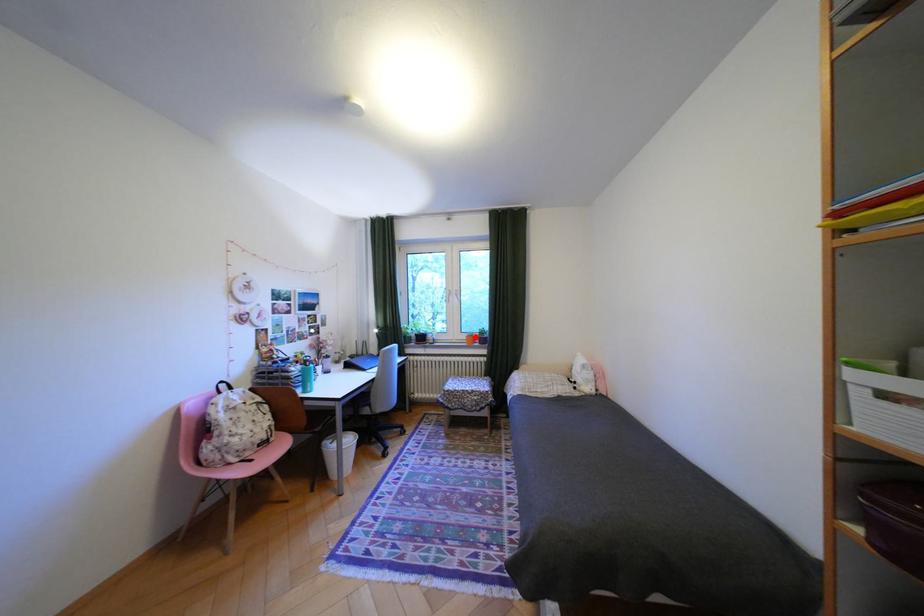
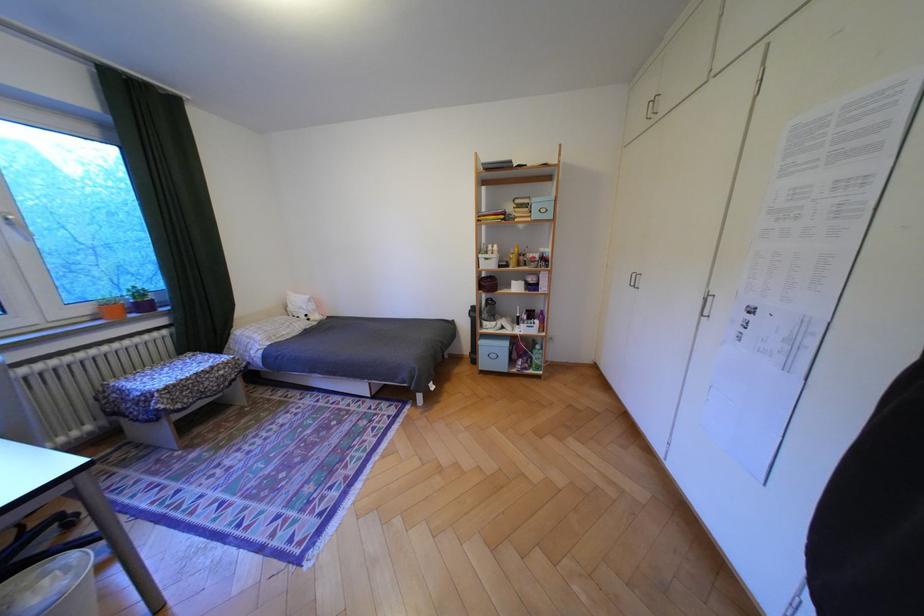
The point at the highlighted location is marked in the first image. Where is the corresponding point in the second image?

(99, 310)